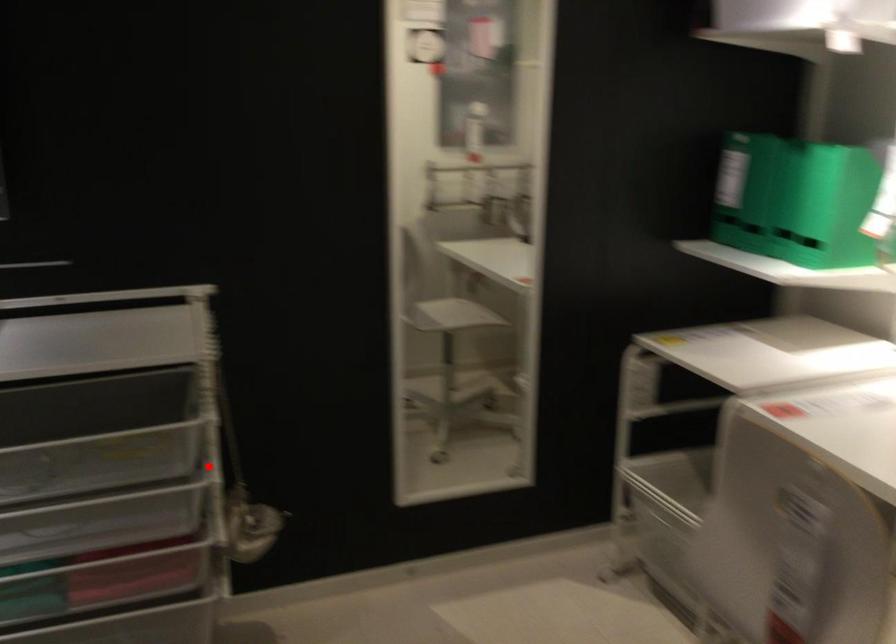
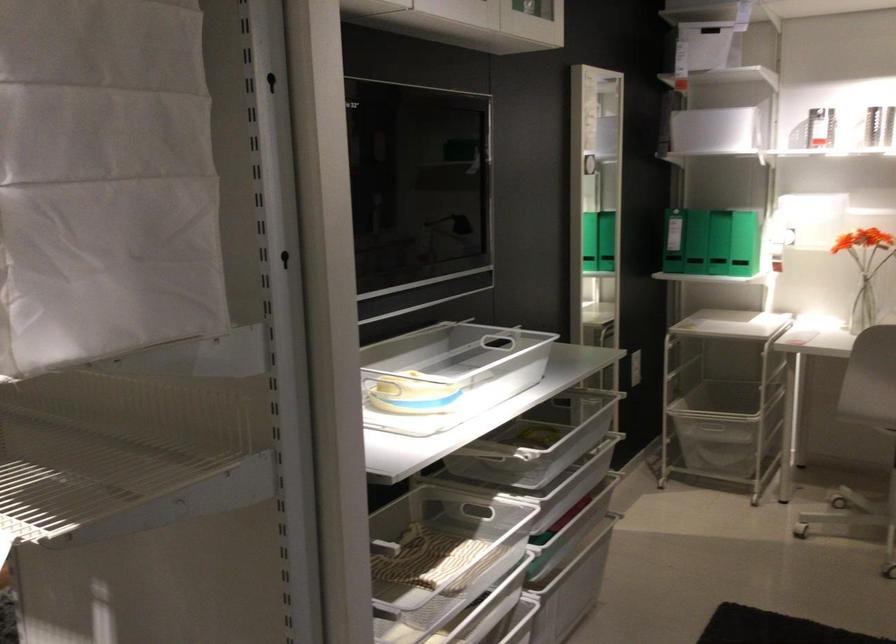
Find the pixel in the second image that matches the highlighted location in the first image.

(561, 428)